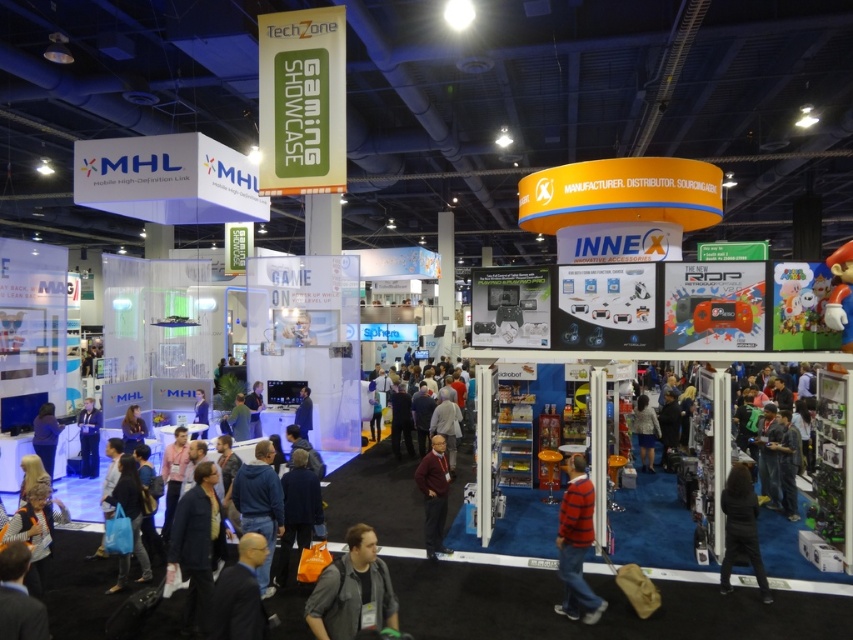
Question: Which object appears closest to the camera in this image?

Choices:
 (A) matte black shirt at center
 (B) striped cotton shirt at center
 (C) maroon fabric shirt at center

Answer: (B)

Question: Does dark blue suit at center have a lesser width compared to dark gray jacket at lower right?

Choices:
 (A) no
 (B) yes

Answer: (B)

Question: Considering the relative positions of striped cotton shirt at center and matte black shirt at center in the image provided, where is striped cotton shirt at center located with respect to matte black shirt at center?

Choices:
 (A) above
 (B) below

Answer: (B)

Question: Which of the following is the farthest from the observer?

Choices:
 (A) (306, 419)
 (B) (358, 582)
 (C) (654, 424)
 (D) (741, 541)

Answer: (A)

Question: Which point is farther to the camera?

Choices:
 (A) striped cotton shirt at center
 (B) dark blue suit at center
 (C) blue fabric at lower left

Answer: (C)

Question: Does dark blue suit at center appear over maroon fabric shirt at center?

Choices:
 (A) yes
 (B) no

Answer: (A)